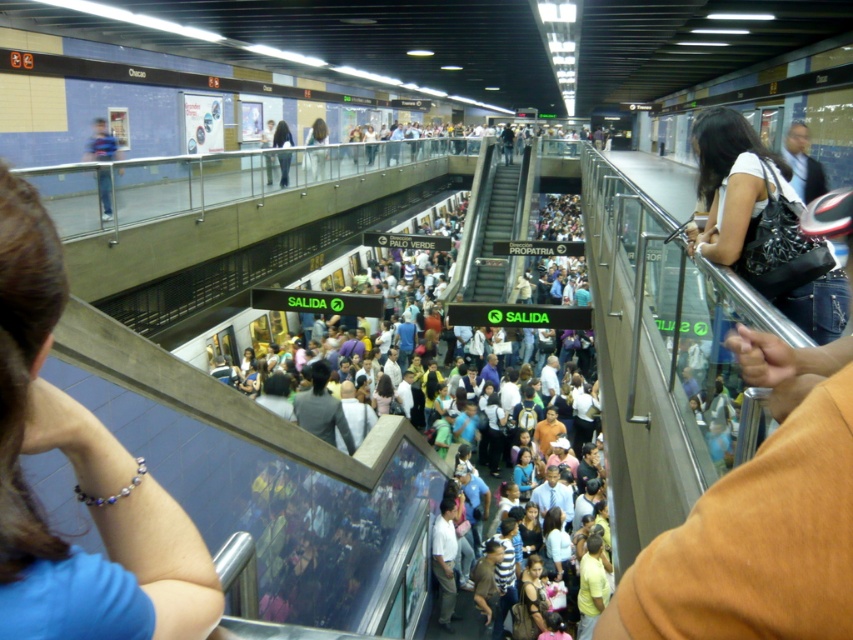
Question: Which point is farther to the camera?

Choices:
 (A) (512, 225)
 (B) (119, 595)

Answer: (A)

Question: Can you confirm if blue fabric bracelet at upper left is positioned below matte black purse at upper right?

Choices:
 (A) yes
 (B) no

Answer: (A)

Question: Which object appears farthest from the camera in this image?

Choices:
 (A) multicolored fabric crowd at center
 (B) metallic escalator at center
 (C) blue fabric bracelet at upper left
 (D) matte black purse at upper right

Answer: (B)

Question: Estimate the real-world distances between objects in this image. Which object is farther from the metallic escalator at center?

Choices:
 (A) blue fabric bracelet at upper left
 (B) multicolored fabric crowd at center
 (C) matte black purse at upper right

Answer: (C)

Question: Can you confirm if multicolored fabric crowd at center is thinner than matte black purse at upper right?

Choices:
 (A) no
 (B) yes

Answer: (A)

Question: Can you confirm if blue fabric bracelet at upper left is positioned below multicolored fabric crowd at center?

Choices:
 (A) no
 (B) yes

Answer: (A)